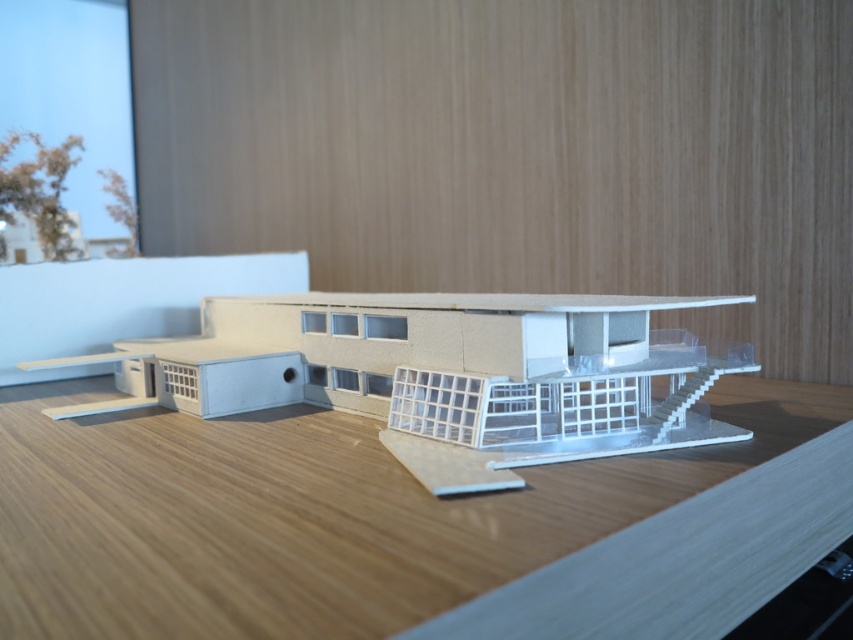
You are an architect examining the architectural model. You notice the wooden table at center and the white matte building at center. Which object is positioned lower in the image?

The wooden table at center is positioned lower than the white matte building at center, as it is described to be below it.

You are a model architect examining the architectural model on the wooden table at center. You need to determine if the white matte building at center will fit on a standard 75cm tall display stand. Can you confirm if the building is shorter than the stand?

The wooden table at center is not as tall as the white matte building at center, so the building is taller than the table. Since the table is placed on a wooden surface, we can infer that the building exceeds the table height. However, without knowing the table height, we cannot directly compare it to the 75cm stand. Therefore, we cannot confirm if the building is shorter than the stand based on the given information.